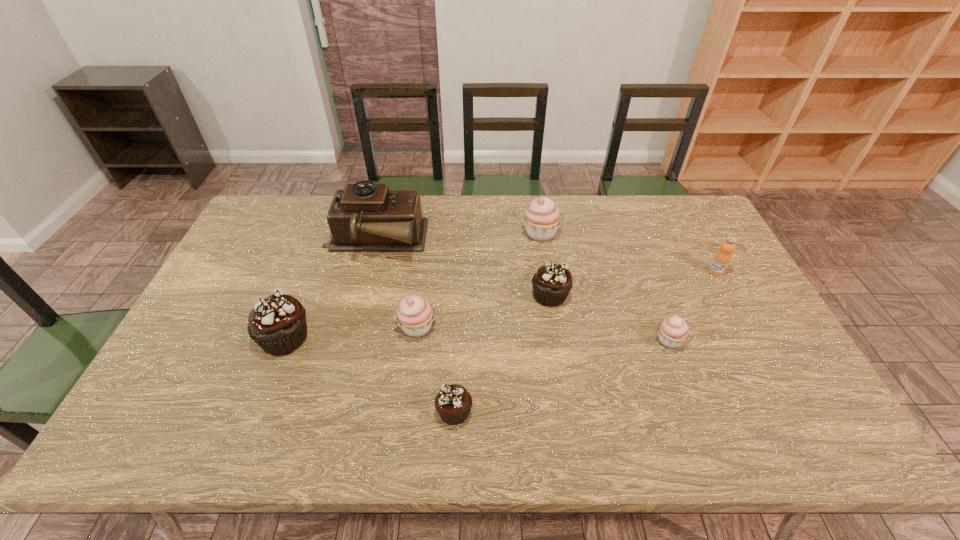
Identify the location of phonograph_record. The image size is (960, 540). (365, 217).

In order to click on the second pink cupcake from left to right in this screenshot , I will do (542, 217).

Locate an element on the screen. This screenshot has height=540, width=960. the farthest pink cupcake is located at coordinates (542, 217).

Locate an element on the screen. This screenshot has width=960, height=540. the second nearest brown cupcake is located at coordinates (277, 323).

Find the location of `the leftmost brown cupcake`. the leftmost brown cupcake is located at coordinates (277, 323).

Identify the location of orange juice. (722, 258).

Identify the location of the rightmost object. The image size is (960, 540). (722, 258).

Identify the location of the fifth nearest cupcake. (552, 283).

Locate an element on the screen. the fourth farthest object is located at coordinates (552, 283).

Where is `the leftmost pink cupcake`? This screenshot has width=960, height=540. the leftmost pink cupcake is located at coordinates (415, 314).